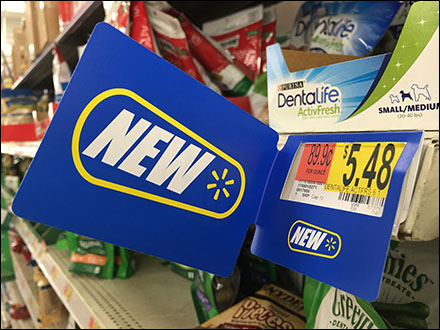
You are a GUI agent. You are given a task and a screenshot of the screen. Output one action in this format:
    pyautogui.click(x=<x>, y=<y>)
    Task: Click on the empty space second shelf under blue sign sticking out
    
    Given the screenshot: What is the action you would take?
    pyautogui.click(x=168, y=296)